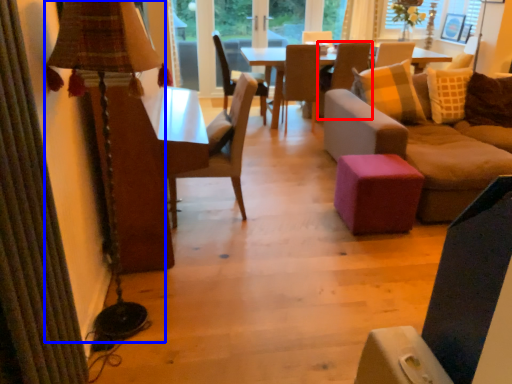
Question: Which point is closer to the camera, chair (highlighted by a red box) or table lamp (highlighted by a blue box)?

Choices:
 (A) chair
 (B) table lamp

Answer: (B)